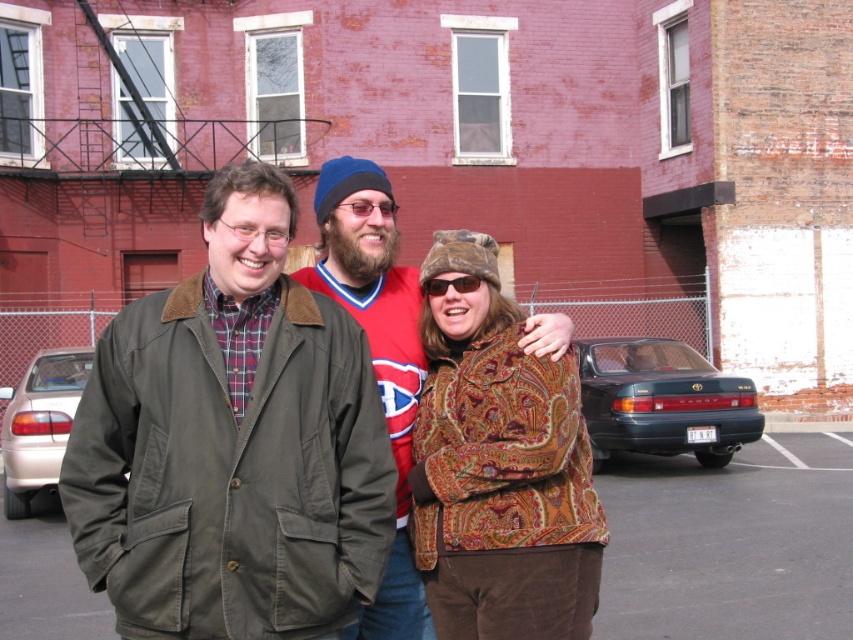
You are a delivery person trying to park your delivery van next to the green metallic sedan at lower right. The van is 2 meters tall. Can you park there without hitting the black plastic sunglasses at center?

The green metallic sedan at lower right is much taller than the black plastic sunglasses at center. Since the van is 2 meters tall, it might still be possible to park there as long as the height of the sedan does not exceed the van height. However, the exact height of the sedan isn